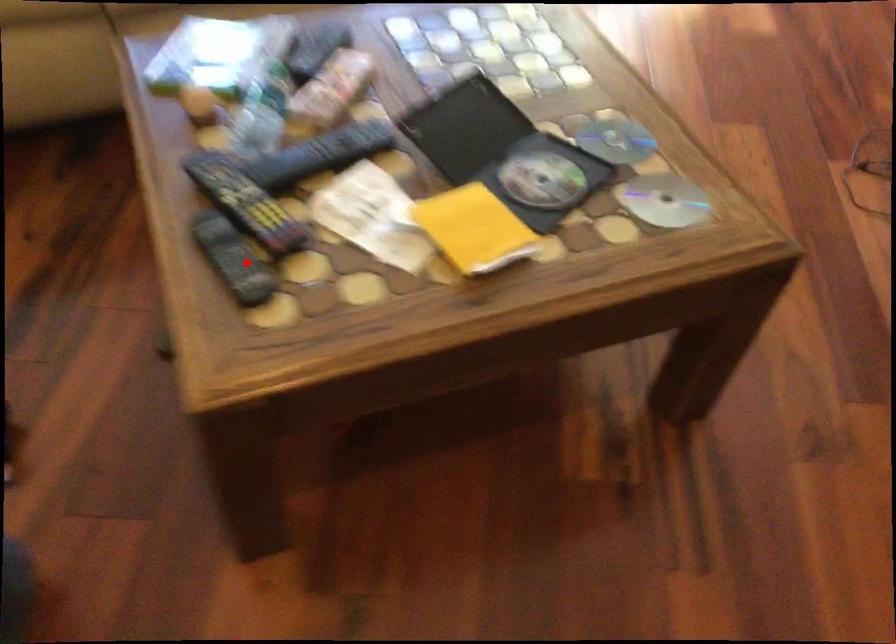
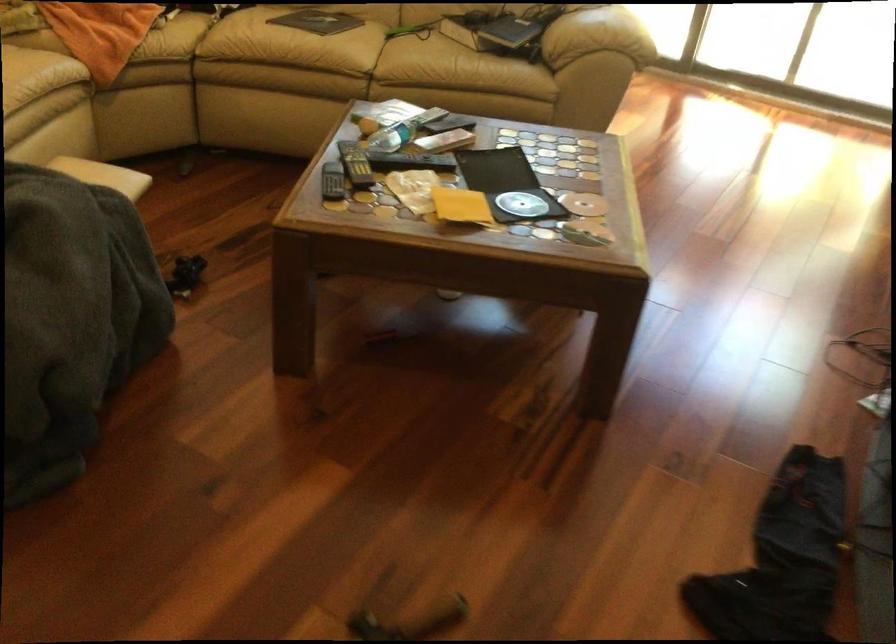
Where in the second image is the point corresponding to the highlighted location from the first image?

(332, 182)